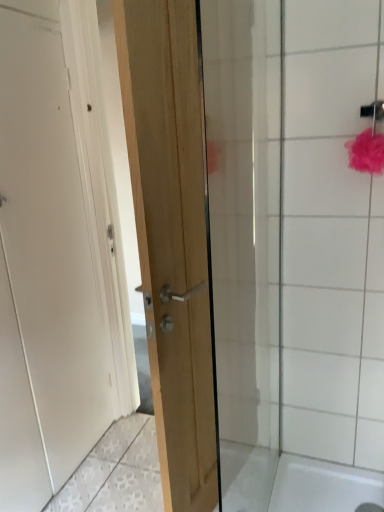
Question: Can white glossy shower door at upper right be found inside white matte door at left, the 1th door from the left?

Choices:
 (A) no
 (B) yes

Answer: (A)

Question: Does white matte door at left, the second door viewed from the right, appear on the right side of white glossy shower door at upper right?

Choices:
 (A) yes
 (B) no

Answer: (B)

Question: Does white matte door at left, the 1th door from the left, have a greater height compared to white glossy shower door at upper right?

Choices:
 (A) yes
 (B) no

Answer: (A)

Question: Are white matte door at left, the second door viewed from the right, and white glossy shower door at upper right located far from each other?

Choices:
 (A) yes
 (B) no

Answer: (B)

Question: From a real-world perspective, is white matte door at left, the second door viewed from the right, over white glossy shower door at upper right?

Choices:
 (A) yes
 (B) no

Answer: (A)

Question: Is white matte door at left, the 1th door from the left, next to white glossy shower door at upper right?

Choices:
 (A) no
 (B) yes

Answer: (A)

Question: Is white matte door at left, the 1th door from the left, positioned far away from natural wood door at center, which ranks as the second door in left-to-right order?

Choices:
 (A) yes
 (B) no

Answer: (B)

Question: Does white matte door at left, the second door viewed from the right, lie behind natural wood door at center, marked as the 1th door in a right-to-left arrangement?

Choices:
 (A) no
 (B) yes

Answer: (B)

Question: Can you confirm if white matte door at left, the second door viewed from the right, is smaller than natural wood door at center, which ranks as the second door in left-to-right order?

Choices:
 (A) no
 (B) yes

Answer: (A)

Question: Is white matte door at left, the second door viewed from the right, bigger than natural wood door at center, which ranks as the second door in left-to-right order?

Choices:
 (A) no
 (B) yes

Answer: (B)

Question: Could you tell me if white matte door at left, the second door viewed from the right, is facing natural wood door at center, marked as the 1th door in a right-to-left arrangement?

Choices:
 (A) no
 (B) yes

Answer: (B)

Question: Can you confirm if white matte door at left, the 1th door from the left, is positioned to the left of natural wood door at center, marked as the 1th door in a right-to-left arrangement?

Choices:
 (A) no
 (B) yes

Answer: (B)

Question: From a real-world perspective, is white glossy shower door at upper right physically above natural wood door at center, which ranks as the second door in left-to-right order?

Choices:
 (A) yes
 (B) no

Answer: (B)